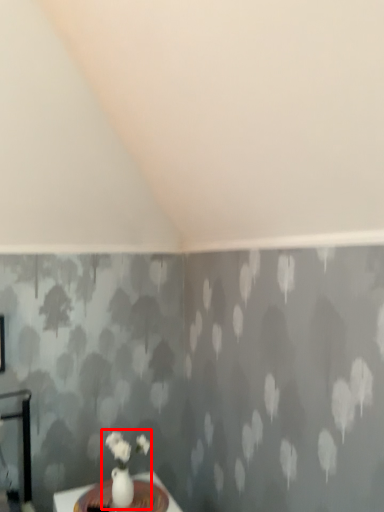
Question: From the image's perspective, considering the relative positions of floral arrangement (annotated by the red box) and table in the image provided, where is floral arrangement (annotated by the red box) located with respect to the staircase?

Choices:
 (A) below
 (B) above

Answer: (B)